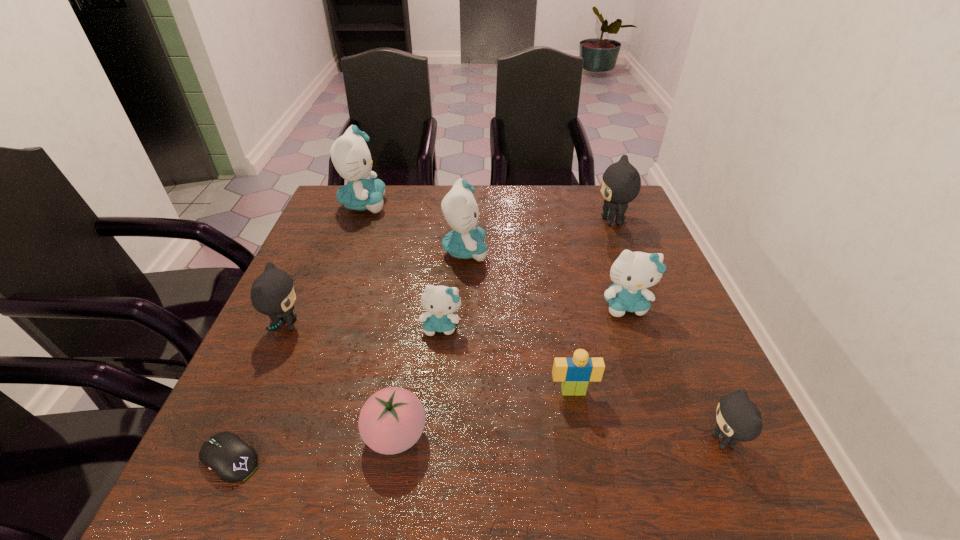
Locate an element on the screen. The image size is (960, 540). tomato that is at the near edge is located at coordinates (392, 420).

What are the coordinates of `computer equipment located at the near edge` in the screenshot? It's located at (226, 454).

Locate an element on the screen. This screenshot has width=960, height=540. computer equipment that is at the left edge is located at coordinates (226, 454).

At what (x,y) coordinates should I click in order to perform the action: click on object present at the far left corner. Please return your answer as a coordinate pair (x, y). Image resolution: width=960 pixels, height=540 pixels. Looking at the image, I should click on (350, 155).

This screenshot has height=540, width=960. In order to click on object positioned at the near left corner in this screenshot , I will do `click(226, 454)`.

At what (x,y) coordinates should I click in order to perform the action: click on object that is positioned at the far right corner. Please return your answer as a coordinate pair (x, y). Looking at the image, I should click on (621, 182).

Image resolution: width=960 pixels, height=540 pixels. What are the coordinates of `object located at the near right corner` in the screenshot? It's located at (738, 419).

The image size is (960, 540). In the image, there is a desktop. Identify the location of vacant space at the far edge. (521, 201).

Locate an element on the screen. vacant space at the near edge of the desktop is located at coordinates (580, 476).

The width and height of the screenshot is (960, 540). What are the coordinates of `vacant region at the left edge of the desktop` in the screenshot? It's located at (306, 264).